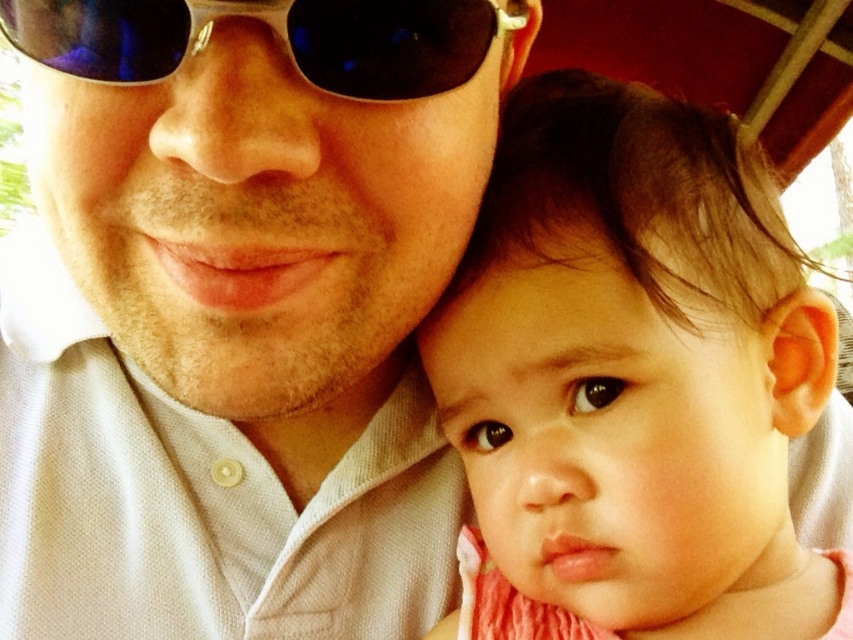
You are taking a photo of two people in the scene. The adult male and the young child are positioned at point [616,616] and point [109,74] respectively. Which person is closer to the camera?

The adult male at point [616,616] is closer to the camera than the young child at point [109,74].

You are a photographer adjusting your camera settings. You notice the matte white shirt at center and the sunglasses at upper center in your frame. Which object should you focus on first if you want to capture the larger object clearly?

The matte white shirt at center is larger in size than the sunglasses at upper center, so you should focus on the matte white shirt at center first to capture the larger object clearly.

You are a photographer adjusting the lighting for a photo shoot. You notice the matte white shirt at center and the smooth pink fabric at center. Which object should you focus on to ensure proper exposure since it is covering the other object?

The matte white shirt at center is positioned over smooth pink fabric at center, so focusing on the matte white shirt at center will ensure proper exposure as it is covering the other object.